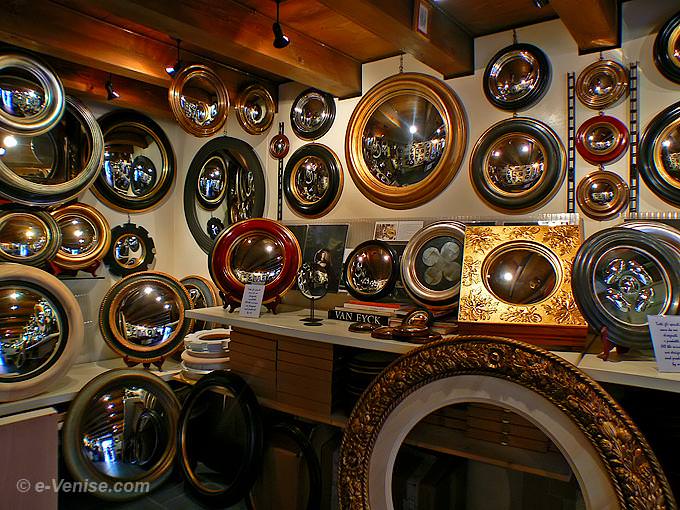
Image resolution: width=680 pixels, height=510 pixels. Find the location of `lights`. lights is located at coordinates (114, 86), (170, 69), (275, 34).